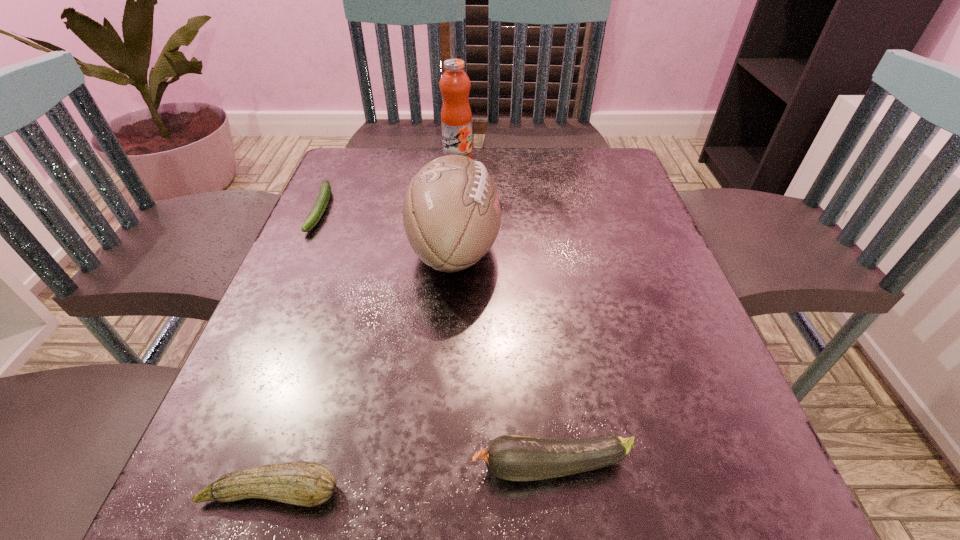
Where is `the farthest object`? The image size is (960, 540). the farthest object is located at coordinates (456, 118).

You are a GUI agent. You are given a task and a screenshot of the screen. Output one action in this format:
    pyautogui.click(x=<x>, y=<y>)
    Task: Click on the tallest object
    The width and height of the screenshot is (960, 540).
    Given the screenshot: What is the action you would take?
    pyautogui.click(x=456, y=118)

Where is `football (American)`? This screenshot has width=960, height=540. football (American) is located at coordinates (452, 211).

You are a GUI agent. You are given a task and a screenshot of the screen. Output one action in this format:
    pyautogui.click(x=<x>, y=<y>)
    Task: Click on the rightmost zucchini
    
    Given the screenshot: What is the action you would take?
    pyautogui.click(x=509, y=457)

This screenshot has height=540, width=960. I want to click on the shortest object, so click(x=321, y=203).

Identify the location of the farthest zucchini. This screenshot has width=960, height=540. (321, 203).

In order to click on vacant region located 0.170m on the front label of the fruit juice in this screenshot , I will do click(455, 201).

Find the location of `vacant space situated on the laces of the second tallest object`. vacant space situated on the laces of the second tallest object is located at coordinates (529, 248).

What are the coordinates of `free region located 0.270m at the blossom end of the rightmost zucchini` in the screenshot? It's located at [x=275, y=466].

In order to click on free space located at the blossom end of the rightmost zucchini in this screenshot , I will do `click(304, 466)`.